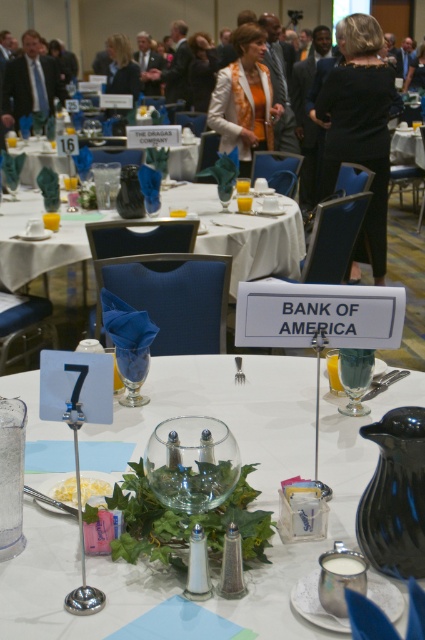
Does white textured blazer at upper center appear over blonde hair at upper center?

No, white textured blazer at upper center is not above blonde hair at upper center.

Who is lower down, white textured blazer at upper center or blonde hair at upper center?

Positioned lower is white textured blazer at upper center.

Does point (255, 125) lie behind point (124, 61)?

No, (255, 125) is in front of (124, 61).

Locate an element on the screen. The image size is (425, 640). white textured blazer at upper center is located at coordinates (244, 99).

Does white glossy tablecloth at center have a smaller size compared to black fabric dress at upper right?

Indeed, white glossy tablecloth at center has a smaller size compared to black fabric dress at upper right.

Can you confirm if white glossy tablecloth at center is bigger than black fabric dress at upper right?

Actually, white glossy tablecloth at center might be smaller than black fabric dress at upper right.

Which is in front, point (53, 429) or point (385, 76)?

Point (53, 429) is more forward.

This screenshot has height=640, width=425. I want to click on white glossy tablecloth at center, so click(x=232, y=412).

Between white fabric tablecloth at upper center and matte black suit at upper left, which one is positioned higher?

matte black suit at upper left is above.

This screenshot has height=640, width=425. What do you see at coordinates (243, 234) in the screenshot? I see `white fabric tablecloth at upper center` at bounding box center [243, 234].

You are a GUI agent. You are given a task and a screenshot of the screen. Output one action in this format:
    pyautogui.click(x=<x>, y=<y>)
    Task: Click on the white fabric tablecloth at upper center
    Image resolution: width=425 pixels, height=640 pixels.
    Given the screenshot: What is the action you would take?
    pyautogui.click(x=243, y=234)